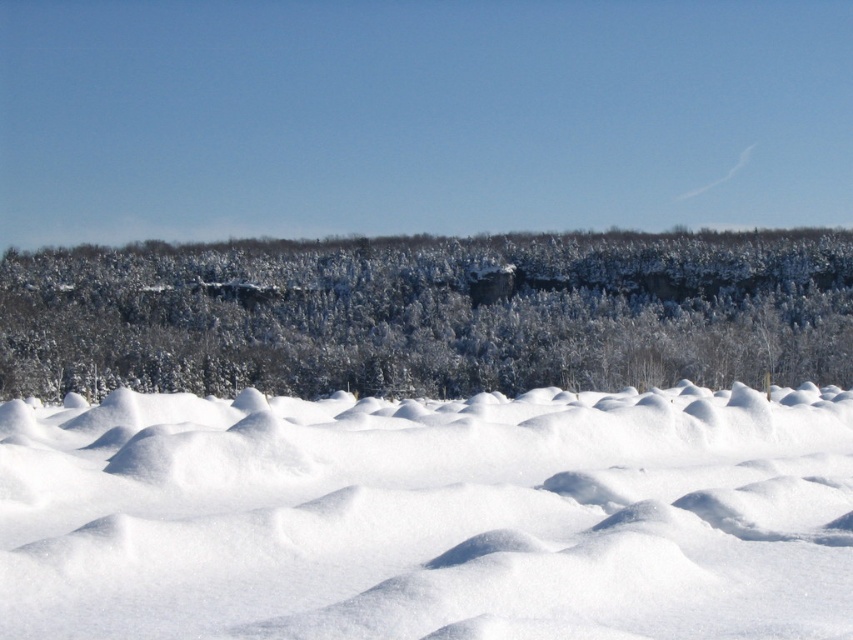
Question: Is white fluffy snow at center behind white snow-covered trees at center?

Choices:
 (A) no
 (B) yes

Answer: (A)

Question: Does white fluffy snow at center lie in front of white snow-covered trees at center?

Choices:
 (A) no
 (B) yes

Answer: (B)

Question: Can you confirm if white fluffy snow at center is positioned below white snow-covered trees at center?

Choices:
 (A) yes
 (B) no

Answer: (A)

Question: Which object appears farthest from the camera in this image?

Choices:
 (A) white snow-covered trees at center
 (B) white fluffy snow at center

Answer: (A)

Question: Which point is farther to the camera?

Choices:
 (A) white snow-covered trees at center
 (B) white fluffy snow at center

Answer: (A)

Question: Which object appears closest to the camera in this image?

Choices:
 (A) white fluffy snow at center
 (B) white snow-covered trees at center

Answer: (A)